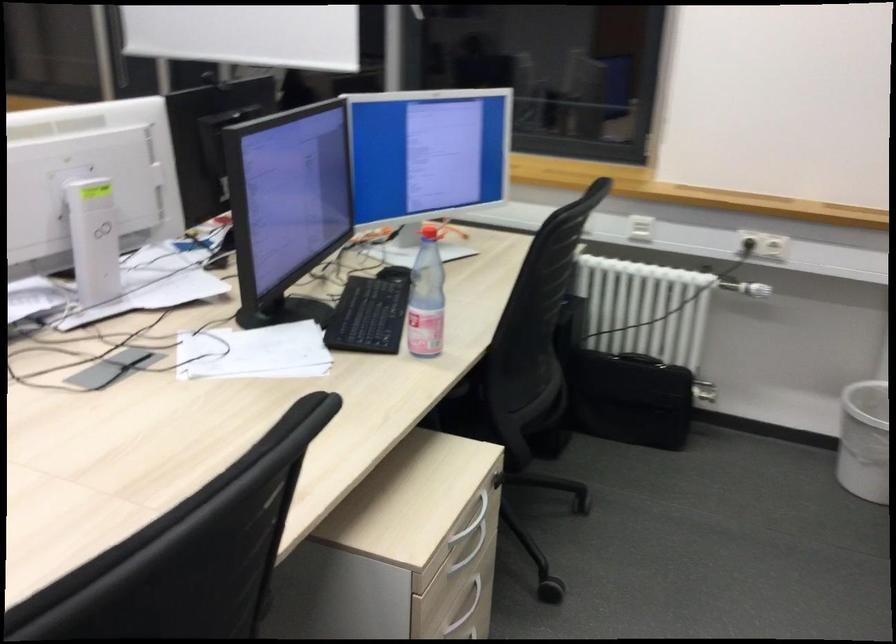
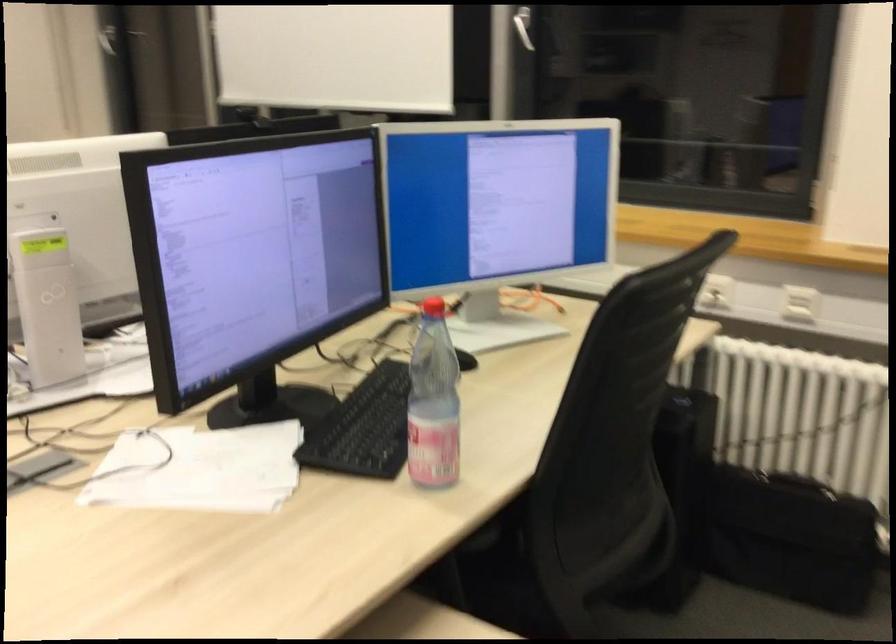
The point at (431, 297) is marked in the first image. Where is the corresponding point in the second image?

(433, 402)